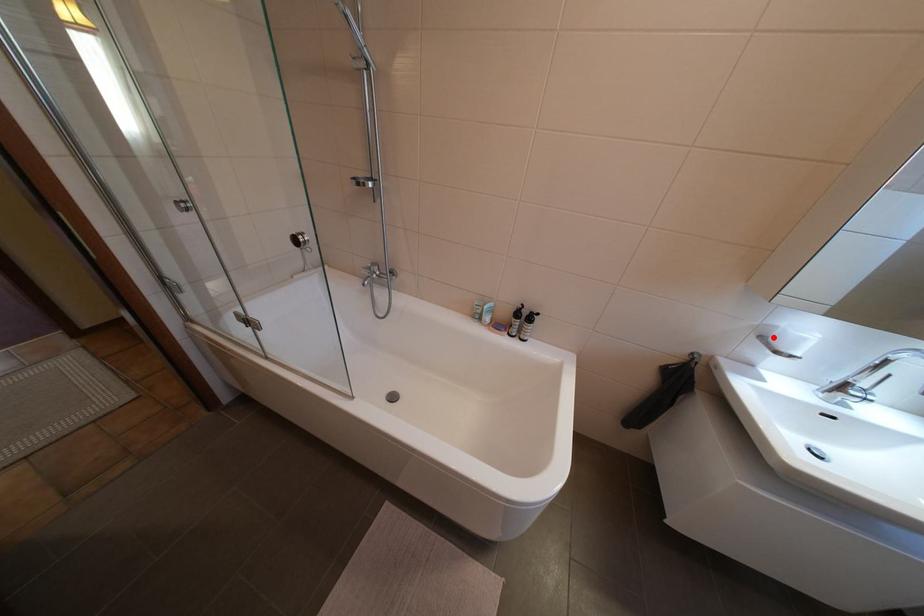
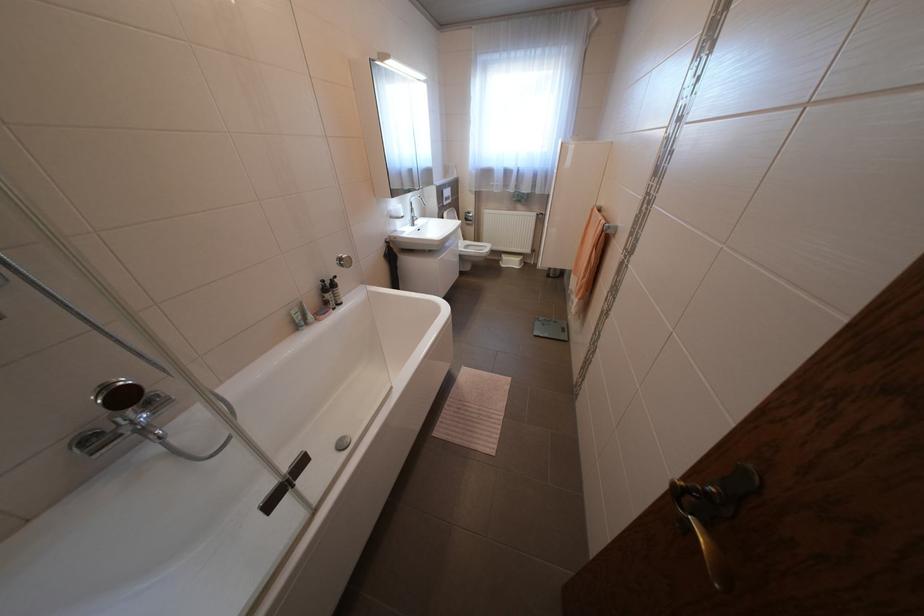
In the second image, find the point that corresponds to the highlighted location in the first image.

(402, 216)